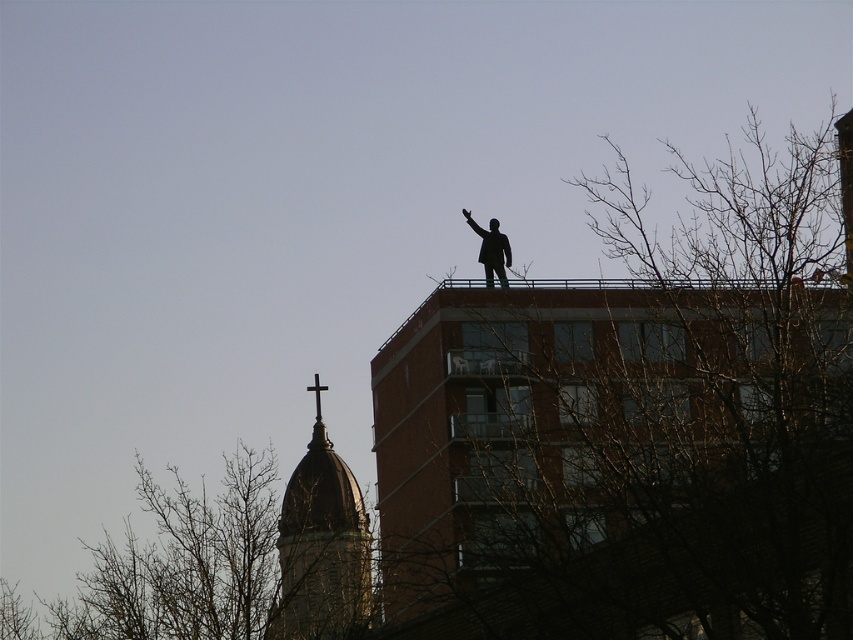
Question: Which point is farther to the camera?

Choices:
 (A) (480, 250)
 (B) (465, 214)

Answer: (B)

Question: Estimate the real-world distances between objects in this image. Which object is closer to the black matte hand at upper center?

Choices:
 (A) dark brown stone tower at upper center
 (B) black matte statue at upper center

Answer: (B)

Question: Can you confirm if bare branches at upper center is positioned below black matte statue at upper center?

Choices:
 (A) yes
 (B) no

Answer: (A)

Question: Can you confirm if dark brown stone tower at upper center is wider than black matte statue at upper center?

Choices:
 (A) no
 (B) yes

Answer: (B)

Question: Which point is closer to the camera taking this photo?

Choices:
 (A) (519, 512)
 (B) (495, 232)
 (C) (329, 564)

Answer: (A)

Question: Observing the image, what is the correct spatial positioning of bare branches at upper center in reference to black matte statue at upper center?

Choices:
 (A) above
 (B) below

Answer: (B)